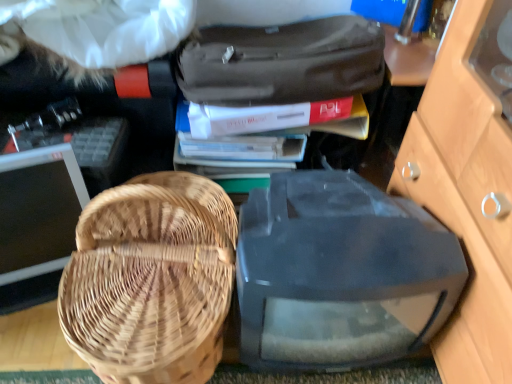
Question: Does matte gray book at upper center, the second book ordered from the bottom, come behind woven wood picnic basket at left?

Choices:
 (A) yes
 (B) no

Answer: (A)

Question: Considering the relative sizes of matte gray book at upper center, placed as the 1th book when sorted from top to bottom, and woven wood picnic basket at left in the image provided, is matte gray book at upper center, placed as the 1th book when sorted from top to bottom, thinner than woven wood picnic basket at left?

Choices:
 (A) yes
 (B) no

Answer: (A)

Question: Considering the relative sizes of matte gray book at upper center, placed as the 1th book when sorted from top to bottom, and woven wood picnic basket at left in the image provided, is matte gray book at upper center, placed as the 1th book when sorted from top to bottom, shorter than woven wood picnic basket at left?

Choices:
 (A) no
 (B) yes

Answer: (B)

Question: Is matte gray book at upper center, the second book ordered from the bottom, positioned beyond the bounds of woven wood picnic basket at left?

Choices:
 (A) yes
 (B) no

Answer: (A)

Question: Is matte gray book at upper center, the second book ordered from the bottom, not close to woven wood picnic basket at left?

Choices:
 (A) yes
 (B) no

Answer: (B)

Question: Considering the relative positions of matte gray book at upper center, placed as the 1th book when sorted from top to bottom, and woven wood picnic basket at left in the image provided, is matte gray book at upper center, placed as the 1th book when sorted from top to bottom, to the left of woven wood picnic basket at left from the viewer's perspective?

Choices:
 (A) yes
 (B) no

Answer: (B)

Question: Is matte black monitor at left, the 2th computer monitor viewed from the right, far away from woven wood picnic basket at left?

Choices:
 (A) no
 (B) yes

Answer: (A)

Question: Is matte black monitor at left, the 2th computer monitor viewed from the right, wider than woven wood picnic basket at left?

Choices:
 (A) no
 (B) yes

Answer: (A)

Question: Considering the relative sizes of matte black monitor at left, the 2th computer monitor viewed from the right, and woven wood picnic basket at left in the image provided, is matte black monitor at left, the 2th computer monitor viewed from the right, taller than woven wood picnic basket at left?

Choices:
 (A) yes
 (B) no

Answer: (B)

Question: Is woven wood picnic basket at left located within matte black monitor at left, the 2th computer monitor viewed from the right?

Choices:
 (A) yes
 (B) no

Answer: (B)

Question: Is matte black monitor at left, the 1th computer monitor when ordered from left to right, not inside woven wood picnic basket at left?

Choices:
 (A) no
 (B) yes

Answer: (B)

Question: Is matte black monitor at left, the 1th computer monitor when ordered from left to right, to the right of woven wood picnic basket at left from the viewer's perspective?

Choices:
 (A) yes
 (B) no

Answer: (B)

Question: Is matte black suitcase at upper center positioned in front of matte black monitor at left, the 2th computer monitor viewed from the right?

Choices:
 (A) no
 (B) yes

Answer: (A)